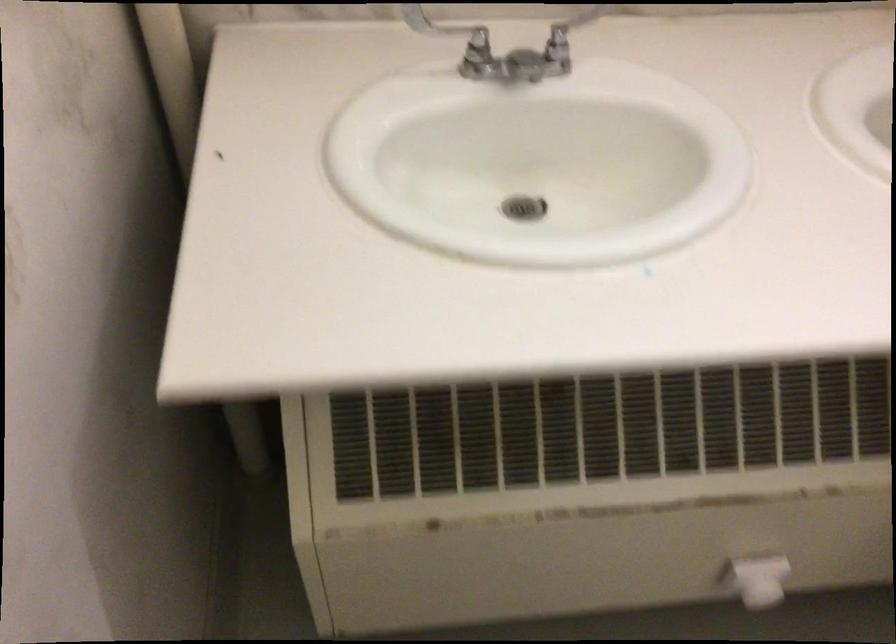
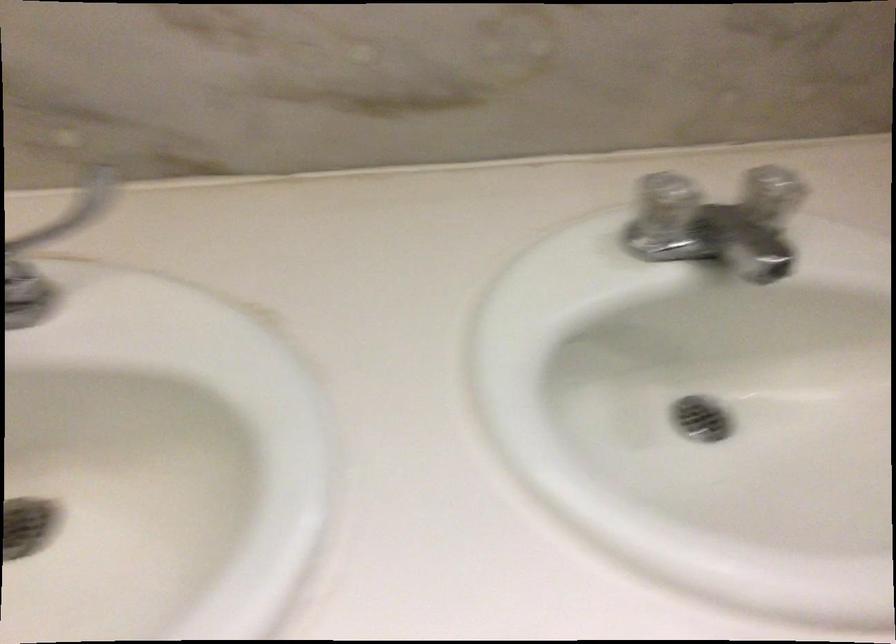
In a continuous first-person perspective shot, in which direction is the camera moving?

The cameraman moved toward right, forward.